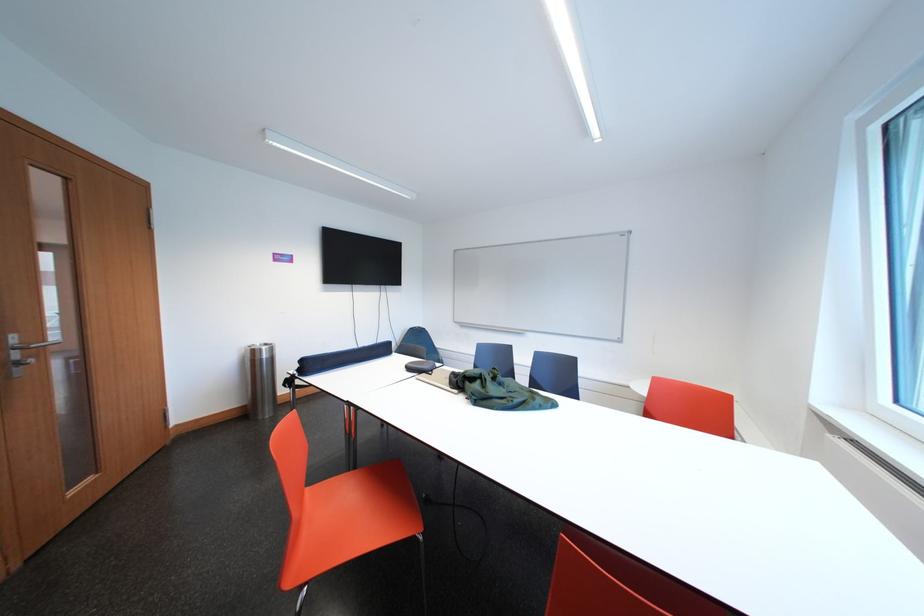
Describe the element at coordinates (23, 352) in the screenshot. I see `the metal door handle` at that location.